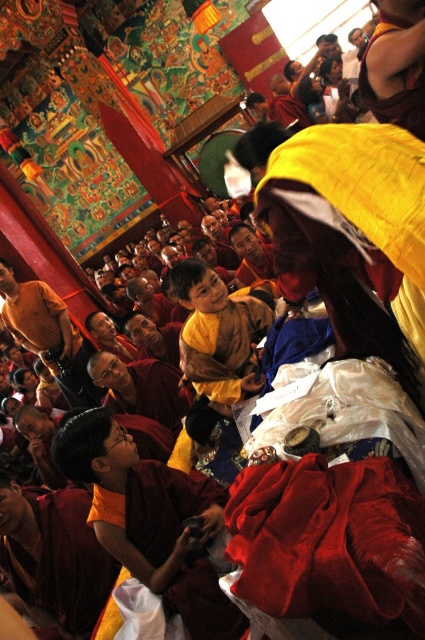
Does velvet red cloth at lower right come in front of orange cotton robe at lower left?

Yes, it is.

Between point (374, 513) and point (164, 595), which one is positioned behind?

Point (164, 595)

Is point (346, 476) positioned after point (130, 512)?

No, (346, 476) is closer to viewer.

Locate an element on the screen. The height and width of the screenshot is (640, 425). velvet red cloth at lower right is located at coordinates (329, 541).

Is orange cotton robe at lower left closer to the viewer compared to yellow cotton monk at upper right?

No, it is behind yellow cotton monk at upper right.

Which is above, orange cotton robe at lower left or yellow cotton monk at upper right?

Positioned higher is yellow cotton monk at upper right.

The width and height of the screenshot is (425, 640). I want to click on orange cotton robe at lower left, so click(158, 506).

Can you confirm if velvet red cloth at lower right is bigger than yellow cotton monk at upper right?

Yes, velvet red cloth at lower right is bigger than yellow cotton monk at upper right.

Is point (238, 516) less distant than point (418, 4)?

Yes, it is.

Identify the location of velvet red cloth at lower right. The image size is (425, 640). (329, 541).